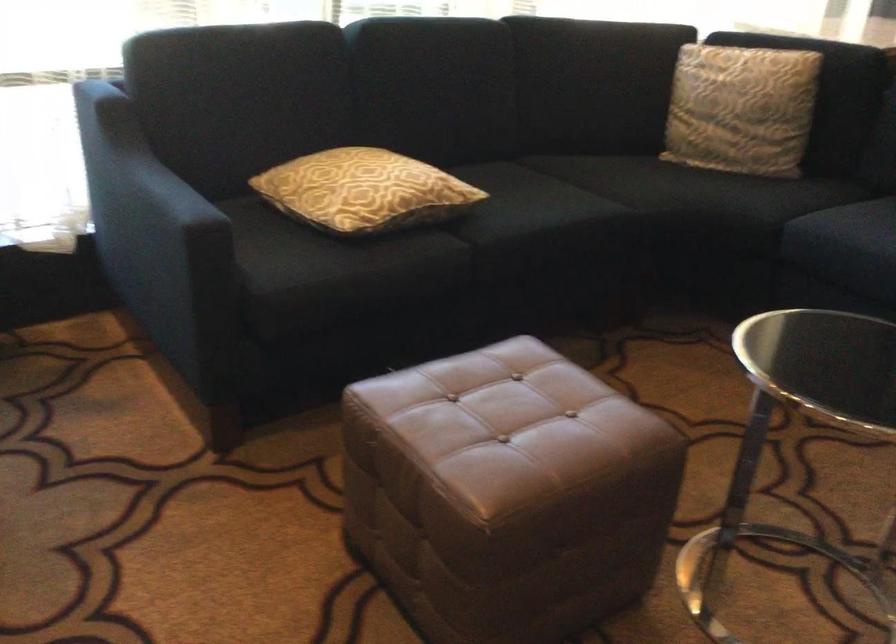
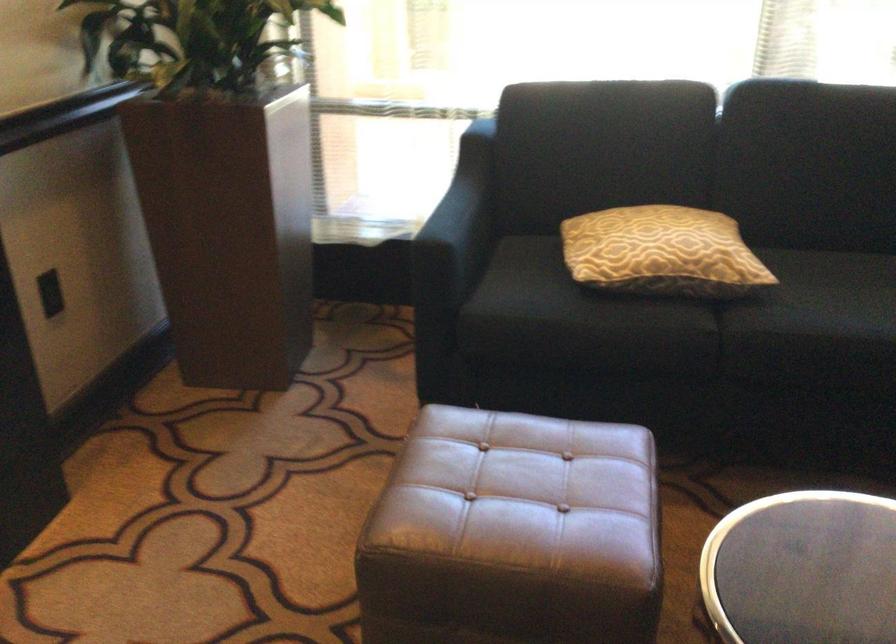
Locate, in the second image, the point that corresponds to (195,207) in the first image.

(458, 225)